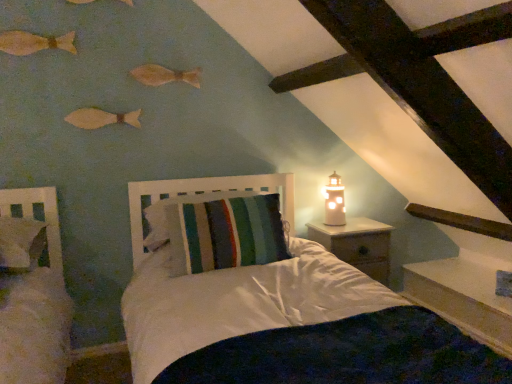
Question: From the image's perspective, relative to wooden fish at upper center, the 2th fish when ordered from bottom to top, is wooden fish at upper left, marked as the second fish in a top-to-bottom arrangement, above or below?

Choices:
 (A) above
 (B) below

Answer: (A)

Question: Considering the relative positions of wooden fish at upper left, marked as the second fish in a top-to-bottom arrangement, and wooden fish at upper center, placed as the third fish when sorted from top to bottom, in the image provided, is wooden fish at upper left, marked as the second fish in a top-to-bottom arrangement, to the left or to the right of wooden fish at upper center, placed as the third fish when sorted from top to bottom,?

Choices:
 (A) right
 (B) left

Answer: (B)

Question: Estimate the real-world distances between objects in this image. Which object is closer to the wooden nightstand at right?

Choices:
 (A) wooden fish at upper center, the 2th fish when ordered from bottom to top
 (B) wooden fish at upper left, the 4th fish positioned from the bottom
 (C) metallic gold lighthouse at right
 (D) wooden fish at upper left, marked as the second fish in a top-to-bottom arrangement
 (E) matte wooden fish at upper left, placed as the fourth fish when sorted from top to bottom

Answer: (C)

Question: Which is farther from the wooden fish at upper center, the 2th fish when ordered from bottom to top?

Choices:
 (A) wooden fish at upper left, marked as the first fish in a top-to-bottom arrangement
 (B) wooden nightstand at right
 (C) striped fabric pillow at center
 (D) wooden fish at upper left, which ranks as the 3th fish in bottom-to-top order
 (E) metallic gold lighthouse at right

Answer: (B)